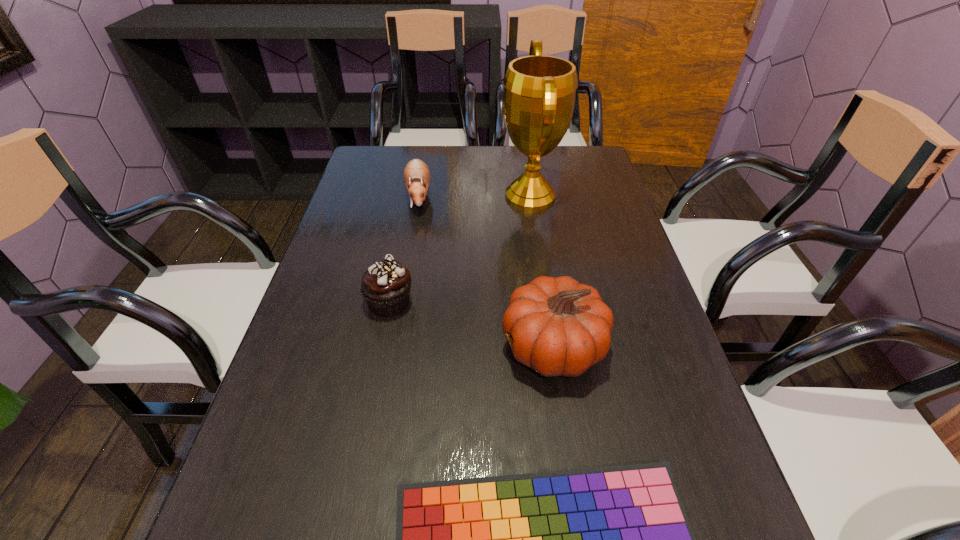
Select which object is the third closest to the hamster. Please provide its 2D coordinates. Your answer should be formatted as a tuple, i.e. [(x, y)], where the tuple contains the x and y coordinates of a point satisfying the conditions above.

[(560, 327)]

This screenshot has width=960, height=540. Find the location of `vacant position in the image that satisfies the following two spatial constraints: 1. on the front-facing side of the award; 2. at the face of the hamster`. vacant position in the image that satisfies the following two spatial constraints: 1. on the front-facing side of the award; 2. at the face of the hamster is located at coordinates (531, 197).

Identify the location of vacant space that satisfies the following two spatial constraints: 1. on the front-facing side of the tallest object; 2. at the face of the hamster. (531, 197).

This screenshot has height=540, width=960. Find the location of `free space that satisfies the following two spatial constraints: 1. on the front-facing side of the tallest object; 2. at the face of the hamster`. free space that satisfies the following two spatial constraints: 1. on the front-facing side of the tallest object; 2. at the face of the hamster is located at coordinates (531, 197).